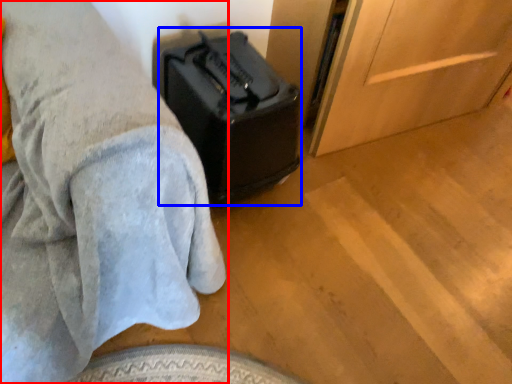
Question: Which of the following is the closest to the observer, furniture (highlighted by a red box) or luggage (highlighted by a blue box)?

Choices:
 (A) furniture
 (B) luggage

Answer: (A)